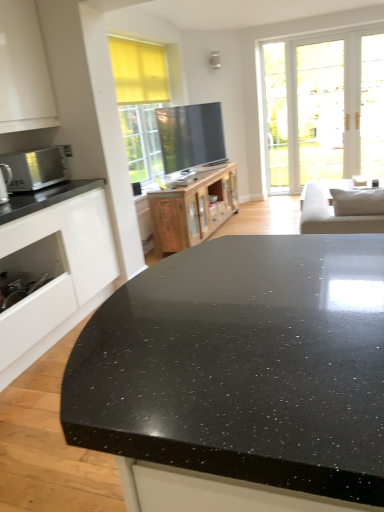
Question: In terms of width, does wooden cabinet at center, which ranks as the 1th cabinetry in back-to-front order, look wider or thinner when compared to satin silver microwave at left?

Choices:
 (A) wide
 (B) thin

Answer: (A)

Question: Is wooden cabinet at center, the second cabinetry viewed from the front, taller or shorter than satin silver microwave at left?

Choices:
 (A) tall
 (B) short

Answer: (A)

Question: Which of these objects is positioned farthest from the black speckled granite countertop at center?

Choices:
 (A) satin silver microwave at left
 (B) white glossy cabinet at left, marked as the 2th cabinetry in a back-to-front arrangement
 (C) matte silver microwave at left
 (D) wooden cabinet at center, which ranks as the 1th cabinetry in back-to-front order

Answer: (D)

Question: Which is nearer to the black speckled granite countertop at center?

Choices:
 (A) matte silver microwave at left
 (B) white glossy cabinet at left, the 1th cabinetry viewed from the left
 (C) wooden cabinet at center, which ranks as the 1th cabinetry in back-to-front order
 (D) satin silver microwave at left

Answer: (B)